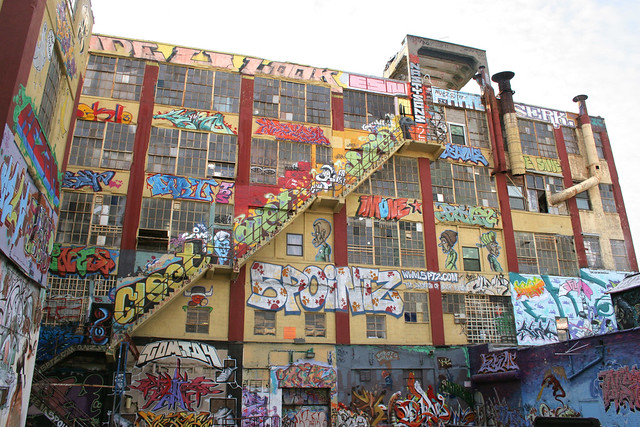
Image resolution: width=640 pixels, height=427 pixels. I want to click on 3rd row of stairs, so click(x=157, y=297).